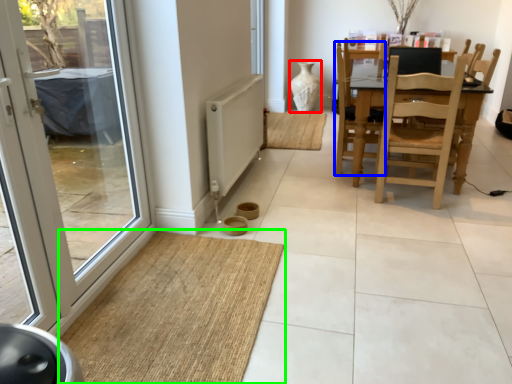
Question: Considering the real-world distances, which object is closest to vase (highlighted by a red box)? swivel chair (highlighted by a blue box) or doormat (highlighted by a green box).

Choices:
 (A) swivel chair
 (B) doormat

Answer: (A)